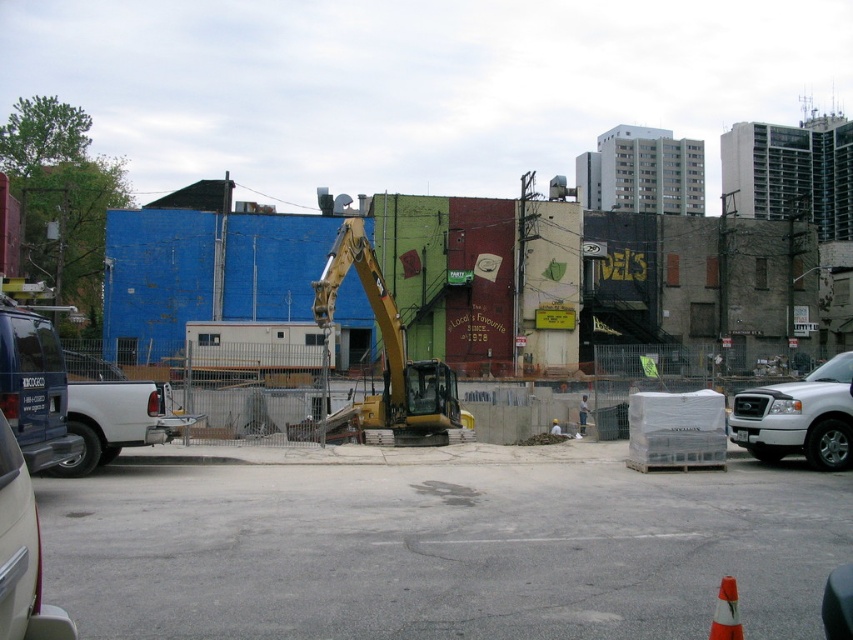
Question: Among these objects, which one is farthest from the camera?

Choices:
 (A) matte blue van at left
 (B) orange reflective cone at lower right
 (C) light blue shirt at center
 (D) beige matte suv at lower left

Answer: (C)

Question: Is yellow metallic excavator at center below white matte truck at left?

Choices:
 (A) yes
 (B) no

Answer: (B)

Question: Estimate the real-world distances between objects in this image. Which object is closer to the orange reflective cone at lower right?

Choices:
 (A) white matte truck at right
 (B) yellow metallic excavator at center
 (C) white matte truck at left
 (D) beige matte suv at lower left

Answer: (D)

Question: Does light blue shirt at center appear under white fabric construction worker at center?

Choices:
 (A) yes
 (B) no

Answer: (B)

Question: Does yellow metallic excavator at center have a larger size compared to white fabric construction worker at center?

Choices:
 (A) yes
 (B) no

Answer: (A)

Question: Which point appears closest to the camera in this image?

Choices:
 (A) (404, 404)
 (B) (44, 456)
 (C) (21, 476)

Answer: (C)